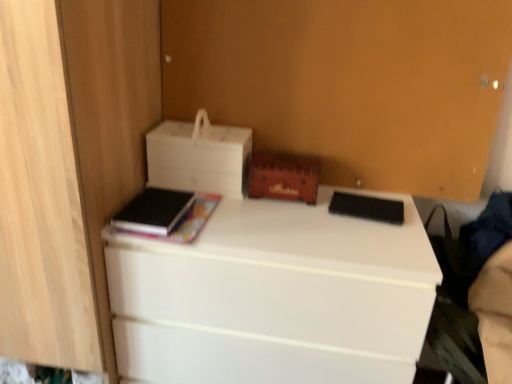
Locate an element on the screen. This screenshot has height=384, width=512. unoccupied region to the right of black matte book at left, acting as the first paperback book starting from the left is located at coordinates (226, 218).